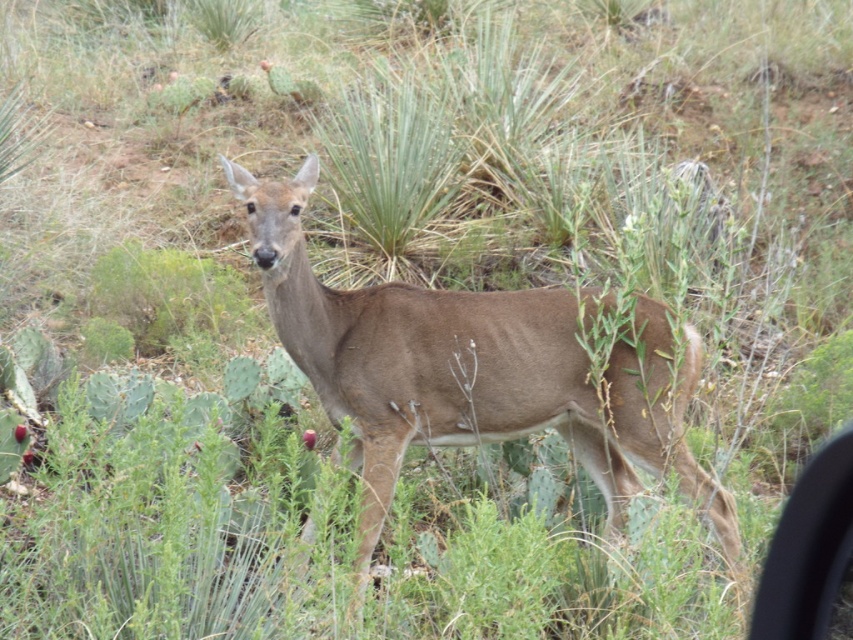
You are a hiker trying to navigate through the desert. You have two landmarks marked on your map as point coordinates. The first is at point (x=306, y=316) and the second is at point (x=788, y=584). If you are facing north, which point is closer to your current position?

Point (x=306, y=316) is behind point (x=788, y=584), so if you are facing north, the point (x=788, y=584) is closer to your current position.